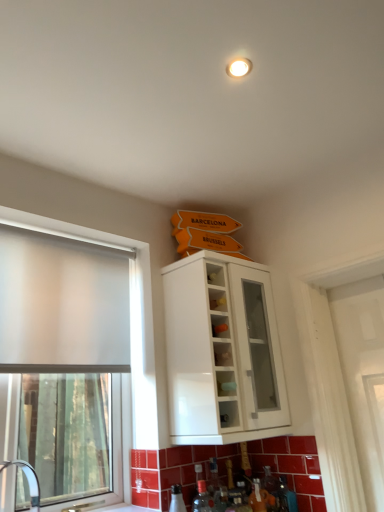
Question: From their relative heights in the image, would you say frosted glass window at left is taller or shorter than white glossy sink at lower left?

Choices:
 (A) tall
 (B) short

Answer: (A)

Question: Looking at the image, does frosted glass window at left seem bigger or smaller compared to white glossy sink at lower left?

Choices:
 (A) big
 (B) small

Answer: (A)

Question: Estimate the real-world distances between objects in this image. Which object is farther from the white glossy sink at lower left?

Choices:
 (A) frosted glass window at left
 (B) white glossy cabinet at upper center

Answer: (B)

Question: Estimate the real-world distances between objects in this image. Which object is farther from the frosted glass window at left?

Choices:
 (A) white glossy sink at lower left
 (B) white glossy cabinet at upper center

Answer: (B)